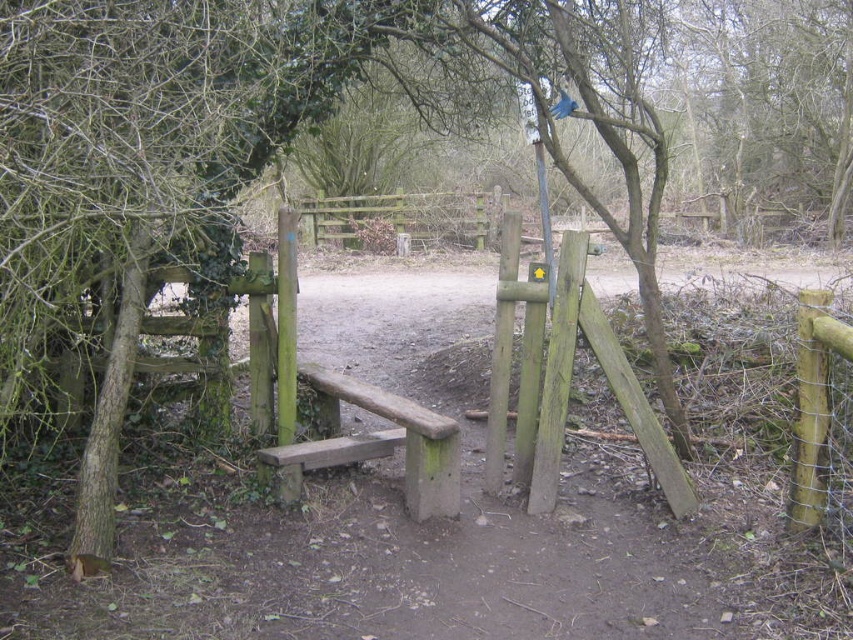
Measure the distance between green mossy wood bench at center and camera.

green mossy wood bench at center and camera are 4.02 meters apart from each other.

Can you confirm if green mossy wood bench at center is thinner than green wooden post at right?

No, green mossy wood bench at center is not thinner than green wooden post at right.

Which is behind, point (289, 456) or point (793, 484)?

Positioned behind is point (289, 456).

The height and width of the screenshot is (640, 853). Find the location of `green mossy wood bench at center`. green mossy wood bench at center is located at coordinates (375, 444).

The image size is (853, 640). What do you see at coordinates (375, 444) in the screenshot? I see `green mossy wood bench at center` at bounding box center [375, 444].

Is green mossy wood bench at center to the right of wooden gate at center from the viewer's perspective?

Yes, green mossy wood bench at center is to the right of wooden gate at center.

In order to click on green mossy wood bench at center in this screenshot , I will do `click(375, 444)`.

You are a GUI agent. You are given a task and a screenshot of the screen. Output one action in this format:
    pyautogui.click(x=<x>, y=<y>)
    Task: Click on the green mossy wood bench at center
    This screenshot has width=853, height=640.
    Given the screenshot: What is the action you would take?
    pyautogui.click(x=375, y=444)

Between point (347, 211) and point (793, 461), which one is positioned behind?

The point (347, 211) is more distant.

Can you confirm if wooden gate at center is smaller than green wooden post at right?

No.

Measure the distance between wooden gate at center and camera.

The distance of wooden gate at center from camera is 16.93 meters.

Locate an element on the screen. wooden gate at center is located at coordinates (405, 218).